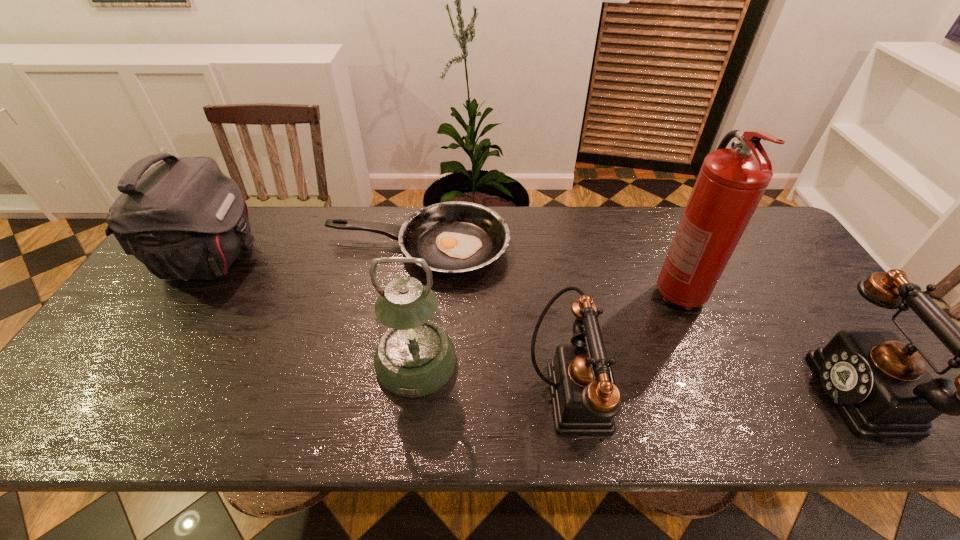
Locate an element on the screen. blank area in the image that satisfies the following two spatial constraints: 1. on the back side of the lantern; 2. on the open flap of the leftmost object is located at coordinates (428, 260).

Find the location of `free region that satisfies the following two spatial constraints: 1. on the handle side the tallest object; 2. on the front of the second shortest object at the rotary dial`. free region that satisfies the following two spatial constraints: 1. on the handle side the tallest object; 2. on the front of the second shortest object at the rotary dial is located at coordinates (722, 394).

Where is `vacant space that satisfies the following two spatial constraints: 1. on the front side of the frying pan; 2. on the open flap of the shoulder bag`? The width and height of the screenshot is (960, 540). vacant space that satisfies the following two spatial constraints: 1. on the front side of the frying pan; 2. on the open flap of the shoulder bag is located at coordinates (416, 260).

Locate an element on the screen. free space that satisfies the following two spatial constraints: 1. on the open flap of the leftmost object; 2. on the back side of the lantern is located at coordinates 148,362.

Find the location of a particular element. vacant space that satisfies the following two spatial constraints: 1. on the open flap of the shoulder bag; 2. on the left side of the lantern is located at coordinates (148, 362).